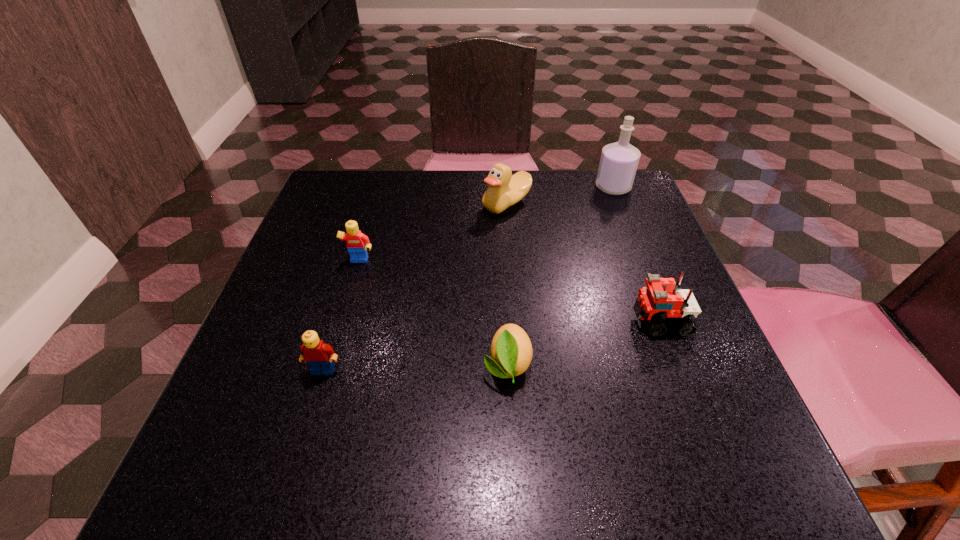
This screenshot has width=960, height=540. Find the location of `Lego located in the right edge section of the desktop`. Lego located in the right edge section of the desktop is located at coordinates (656, 303).

Where is `object that is at the far right corner`? object that is at the far right corner is located at coordinates (618, 164).

Identify the location of vacant area at the far edge of the desktop. (570, 176).

Image resolution: width=960 pixels, height=540 pixels. What are the coordinates of `free space at the left edge of the desktop` in the screenshot? It's located at (299, 238).

I want to click on blank space at the right edge of the desktop, so [x=642, y=252].

The image size is (960, 540). In the image, there is a desktop. In order to click on vacant space at the far left corner in this screenshot , I will do `click(348, 171)`.

I want to click on vacant space at the near left corner, so click(x=307, y=445).

Find the location of a particular element. The width and height of the screenshot is (960, 540). vacant region at the far right corner is located at coordinates tap(608, 200).

Locate an element on the screen. This screenshot has width=960, height=540. free space between the farthest Lego and the nearest Lego is located at coordinates (342, 316).

Find the location of a particular element. free area in between the tallest object and the duck is located at coordinates [560, 195].